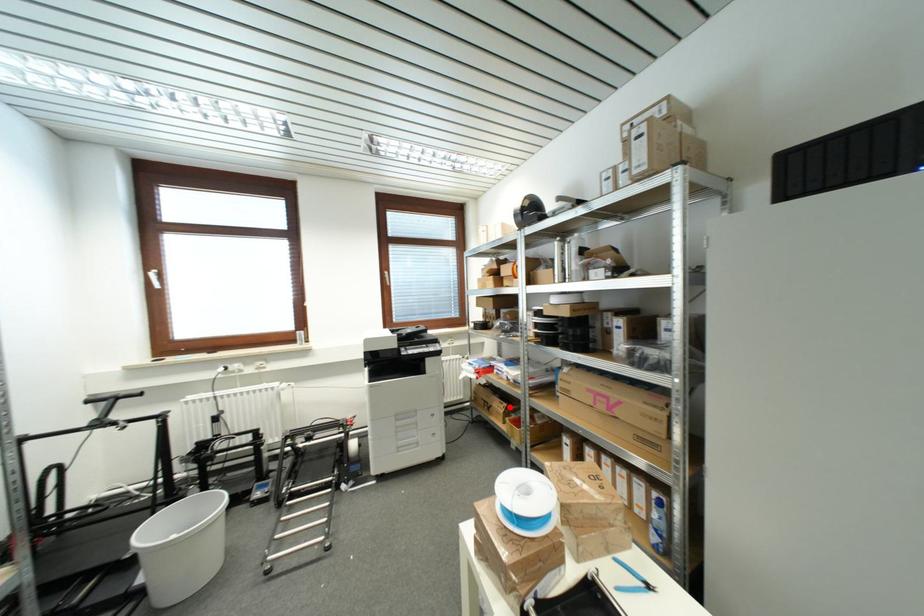
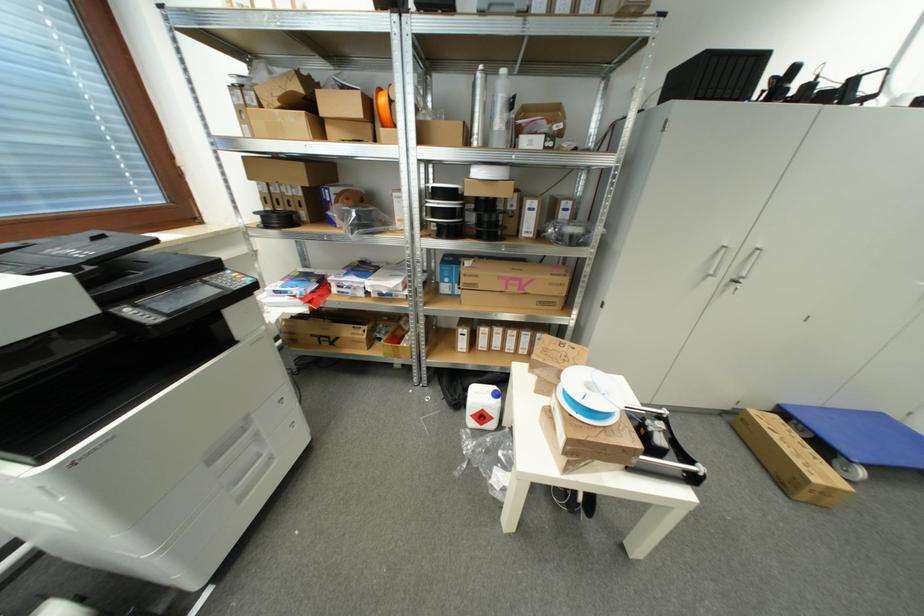
In the second image, find the point that corresponds to the highlighted location in the first image.

(370, 330)